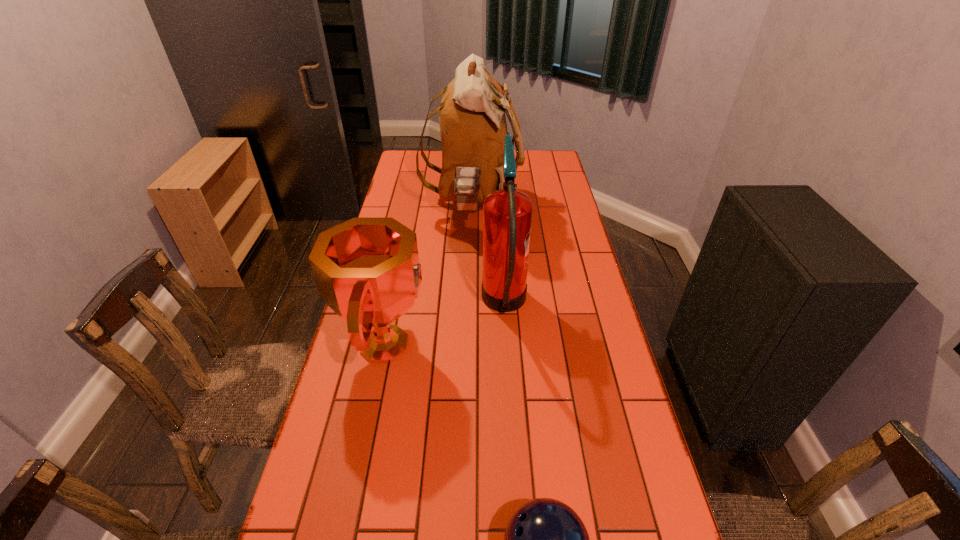
Identify the location of backpack. This screenshot has height=540, width=960. (472, 120).

Locate an element on the screen. Image resolution: width=960 pixels, height=540 pixels. fire extinguisher is located at coordinates (507, 213).

The width and height of the screenshot is (960, 540). I want to click on the third tallest object, so click(x=367, y=270).

Identify the location of vacant space situated on the front-facing side of the backpack. (558, 206).

The height and width of the screenshot is (540, 960). I want to click on vacant space situated on the left of the fire extinguisher, so click(x=453, y=305).

Find the location of a particular element. This screenshot has height=540, width=960. vacant point located 0.130m on the side of the award with the star emblem is located at coordinates (474, 345).

The height and width of the screenshot is (540, 960). I want to click on backpack at the left edge, so click(472, 120).

The image size is (960, 540). Identify the location of award that is at the left edge. (367, 270).

The image size is (960, 540). I want to click on free space at the left edge of the desktop, so click(409, 200).

Locate an element on the screen. blank space at the right edge of the desktop is located at coordinates (555, 221).